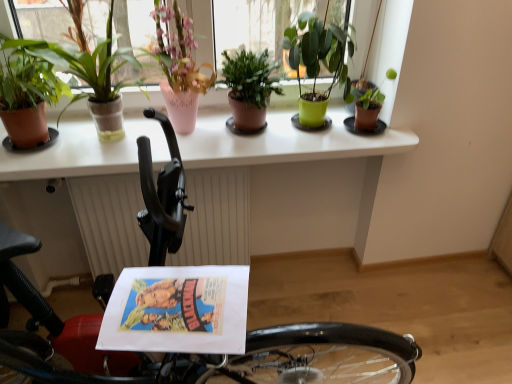
Identify the location of free spot below green matte plant at center, the 4th houseplant positioned from the left (from a real-world perspective). click(261, 135).